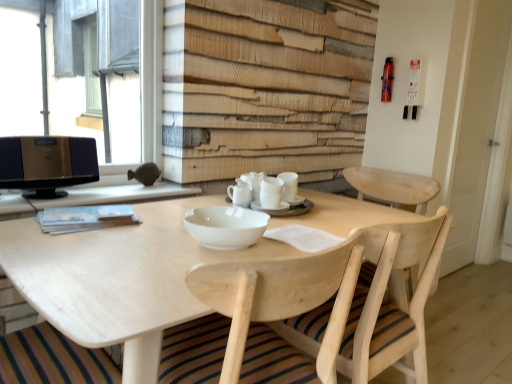
At what (x,y) coordinates should I click in order to perform the action: click on free point below satin silver speaker at upper left (from a real-world perspective). Please return your answer as a coordinate pair (x, y). This screenshot has width=512, height=384. Looking at the image, I should click on (49, 196).